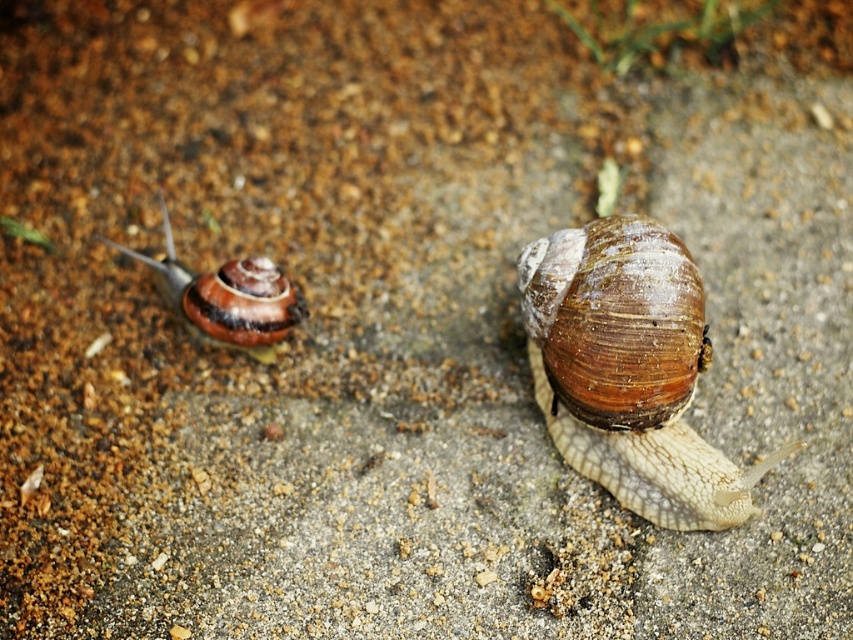
You are a gardener trying to identify which snail shell is wider. You see the brown shiny shell at center and the shiny brown shell at left. Which one has a wider width?

The shiny brown shell at left has a wider width than the brown shiny shell at center.

You are standing in front of a path with two snails. You see a point at coordinates point (579, 420) and another at point (225, 266). Which point is nearer to you?

Point (579, 420) is closer to the viewer than point (225, 266).